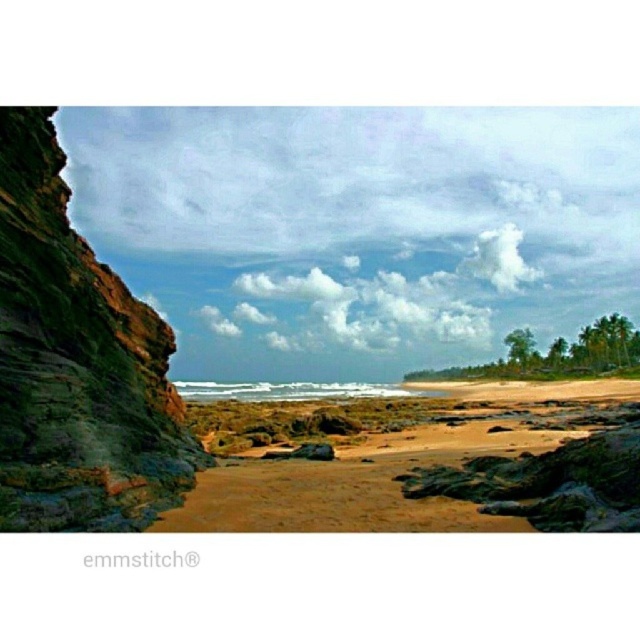
The height and width of the screenshot is (640, 640). In order to click on green mossy rock at left in this screenshot , I will do `click(76, 364)`.

Between point (97, 378) and point (433, 440), which one is positioned in front?

Point (97, 378) is in front.

In order to click on green mossy rock at left in this screenshot , I will do `click(76, 364)`.